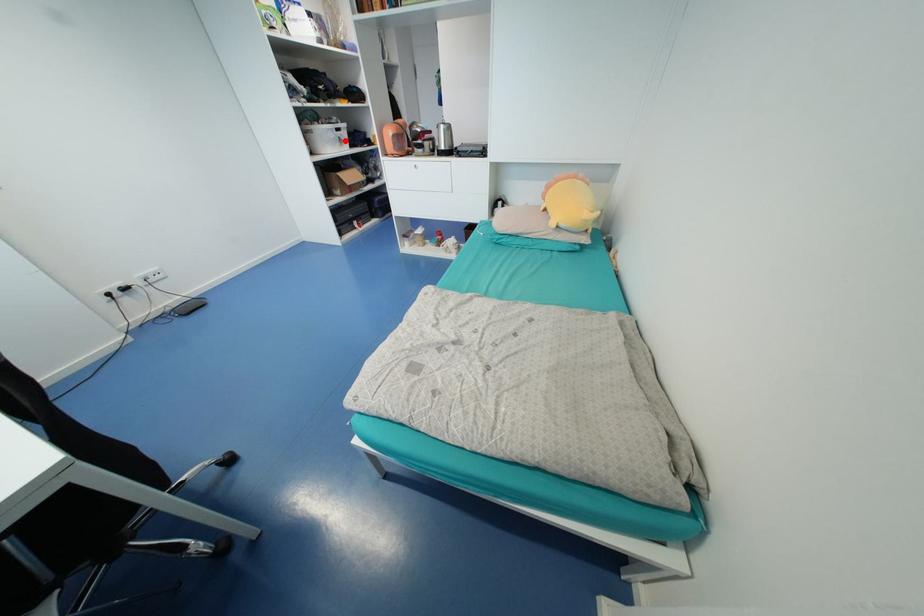
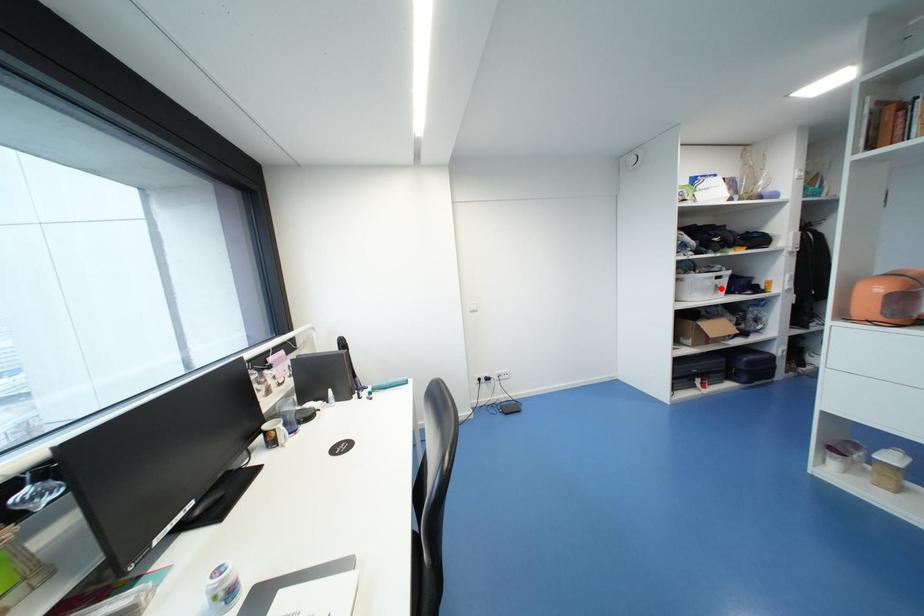
I am providing you with two images of the same scene from different viewpoints. A red point is marked on the first image and another point is marked on the second image. Is the marked point in image1 the same physical position as the marked point in image2?

Yes